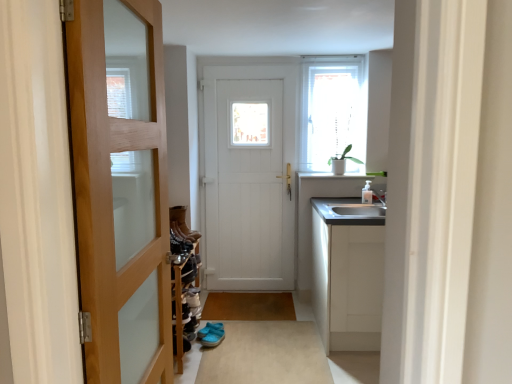
At what (x,y) coordinates should I click in order to perform the action: click on blank area beneath white wooden door at center, which appears as the first door when viewed from the back (from a real-world perspective). Please return your answer as a coordinate pair (x, y). The width and height of the screenshot is (512, 384). Looking at the image, I should click on (251, 286).